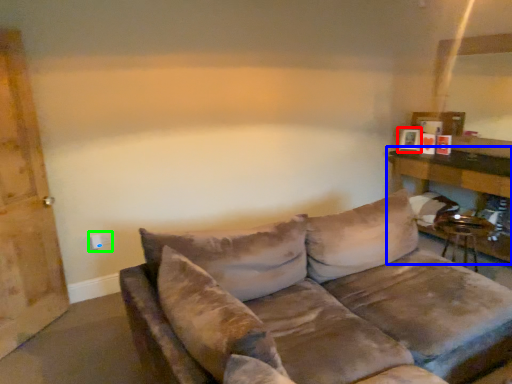
Question: Which object is the closest to the picture frame (highlighted by a red box)? Choose among these: table (highlighted by a blue box) or electric outlet (highlighted by a green box).

Choices:
 (A) table
 (B) electric outlet

Answer: (A)